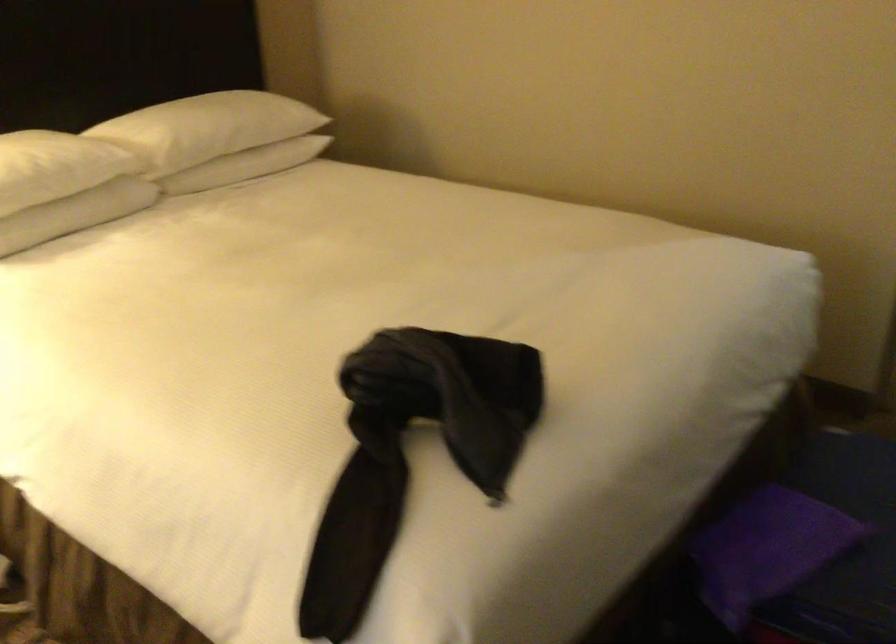
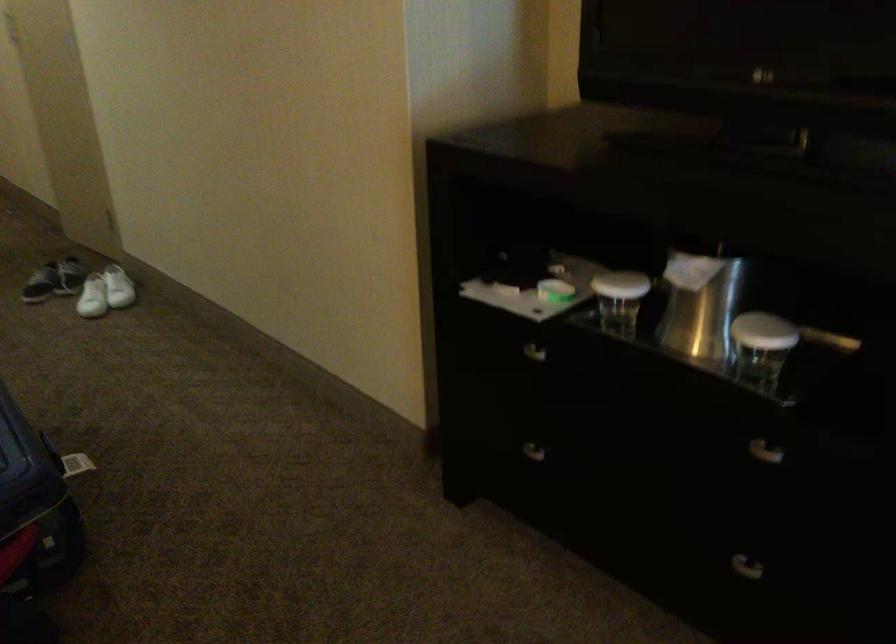
Based on the continuous images, in which direction is the camera rotating?

The rotation direction of the camera is right-down.